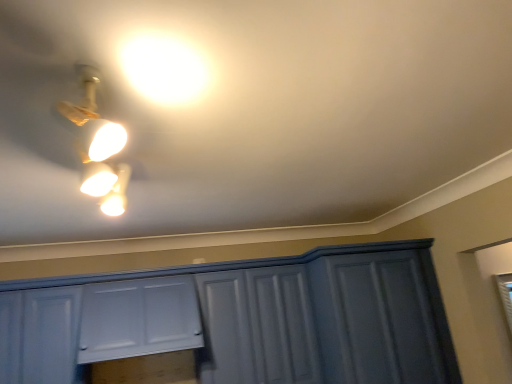
At what (x,y) coordinates should I click in order to perform the action: click on blue matte screen door at lower right. Please return your answer as a coordinate pair (x, y). Looking at the image, I should click on (381, 319).

Image resolution: width=512 pixels, height=384 pixels. What do you see at coordinates (381, 319) in the screenshot?
I see `blue matte screen door at lower right` at bounding box center [381, 319].

The height and width of the screenshot is (384, 512). In order to click on blue matte screen door at lower right in this screenshot , I will do `click(381, 319)`.